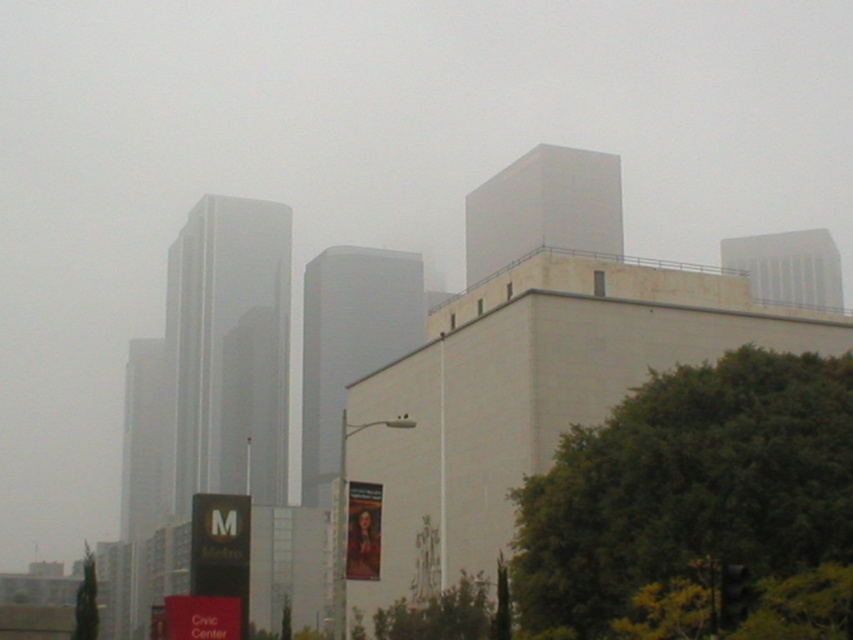
You are standing in the urban scene described. There is a point marked at coordinates point (689, 484). What object does this point correspond to?

The point (689, 484) corresponds to the green leafy tree at lower right.

You are a city planner analyzing the urban scene. You need to determine which object at the lower right corner of the image occupies more horizontal space. Which one is wider between the green leafy tree at lower right and the black matte traffic light at lower right?

The green leafy tree at lower right is wider than the black matte traffic light at lower right according to the description.